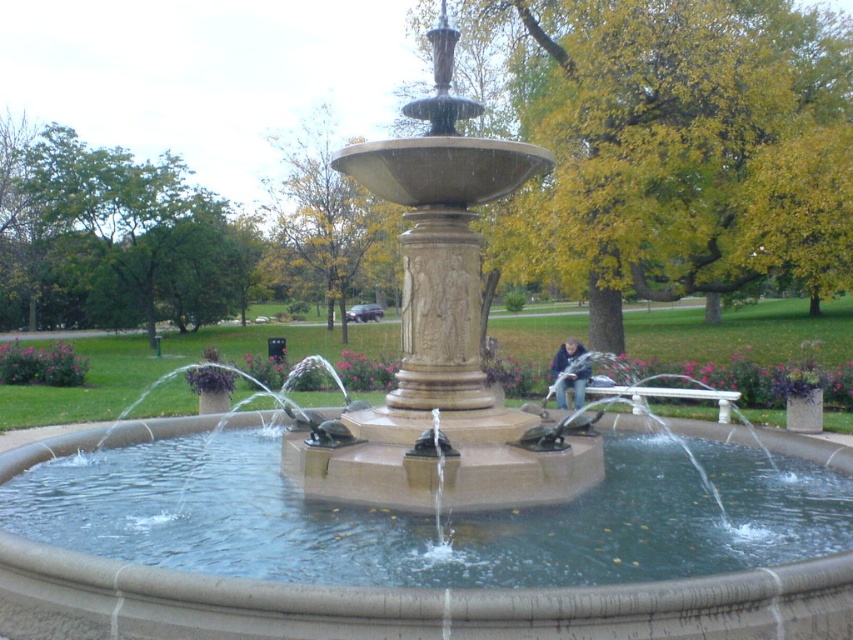
Question: Does white marble bench at lower right have a lesser width compared to blue denim jacket at center?

Choices:
 (A) yes
 (B) no

Answer: (B)

Question: Which point is closer to the camera taking this photo?

Choices:
 (A) (581, 355)
 (B) (694, 400)

Answer: (A)

Question: Observing the image, what is the correct spatial positioning of white marble bench at lower right in reference to blue denim jacket at center?

Choices:
 (A) left
 (B) right

Answer: (B)

Question: Observing the image, what is the correct spatial positioning of white marble bench at lower right in reference to blue denim jacket at center?

Choices:
 (A) left
 (B) right

Answer: (B)

Question: Which of the following is the farthest from the observer?

Choices:
 (A) blue denim jacket at center
 (B) white marble bench at lower right

Answer: (A)

Question: Which object appears closest to the camera in this image?

Choices:
 (A) blue denim jacket at center
 (B) white marble bench at lower right

Answer: (B)